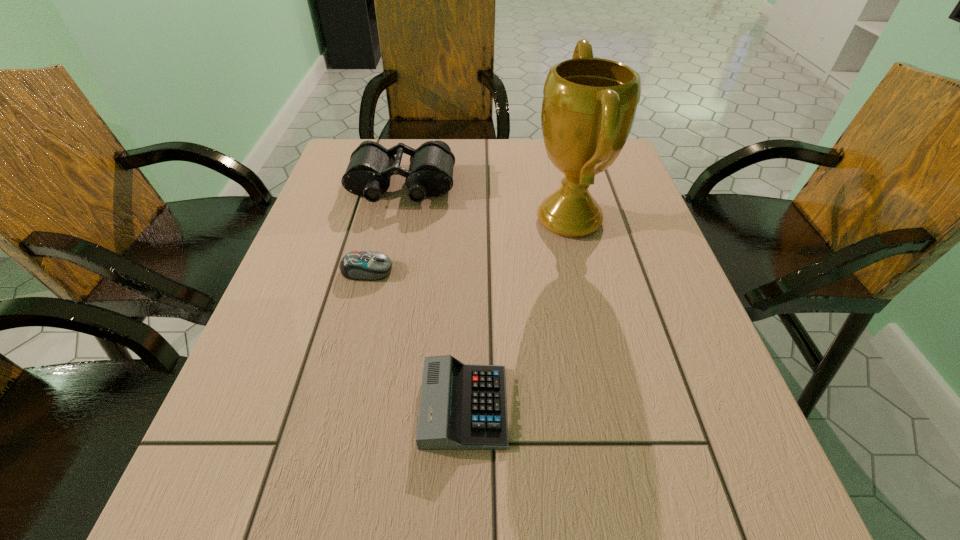
This screenshot has width=960, height=540. What are the coordinates of `vacant area between the computer mouse and the binoculars` in the screenshot? It's located at (384, 228).

Identify the location of vacant point located between the computer mouse and the third shortest object. The height and width of the screenshot is (540, 960). (384, 228).

Locate an element on the screen. free space between the calculator and the tallest object is located at coordinates (516, 313).

Image resolution: width=960 pixels, height=540 pixels. I want to click on free space that is in between the computer mouse and the award, so click(x=468, y=245).

Image resolution: width=960 pixels, height=540 pixels. Find the location of `free space between the tallest object and the nearest object`. free space between the tallest object and the nearest object is located at coordinates tap(516, 313).

Identify the location of object identified as the closest to the award. The height and width of the screenshot is (540, 960). (430, 174).

You are a GUI agent. You are given a task and a screenshot of the screen. Output one action in this format:
    pyautogui.click(x=<x>, y=<y>)
    Task: Click on the object that is the third nearest to the nearest object
    
    Given the screenshot: What is the action you would take?
    pyautogui.click(x=430, y=174)

Locate an element on the screen. vacant space that satisfies the following two spatial constraints: 1. through the eyepieces of the binoculars; 2. on the wheel side of the computer mouse is located at coordinates pyautogui.click(x=383, y=271).

Where is `vacant area in the image that satisfies the following two spatial constraints: 1. through the eyepieces of the second tallest object; 2. on the wheel side of the computer mouse`? The image size is (960, 540). vacant area in the image that satisfies the following two spatial constraints: 1. through the eyepieces of the second tallest object; 2. on the wheel side of the computer mouse is located at coordinates (383, 271).

The image size is (960, 540). What are the coordinates of `free point that satisfies the following two spatial constraints: 1. through the eyepieces of the binoculars; 2. on the wheel side of the computer mouse` in the screenshot? It's located at (383, 271).